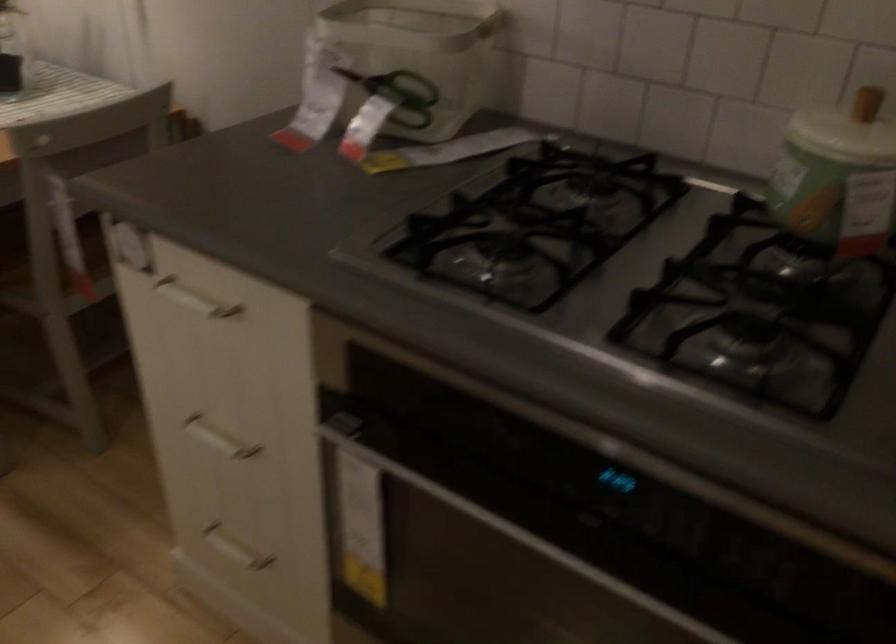
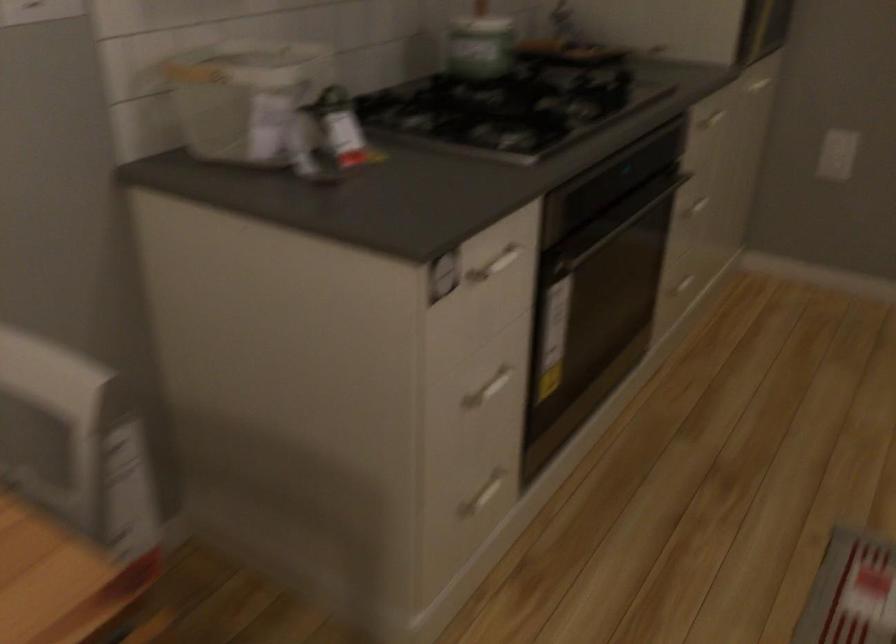
Locate, in the second image, the point that corresponds to [268,558] in the first image.

(484, 494)